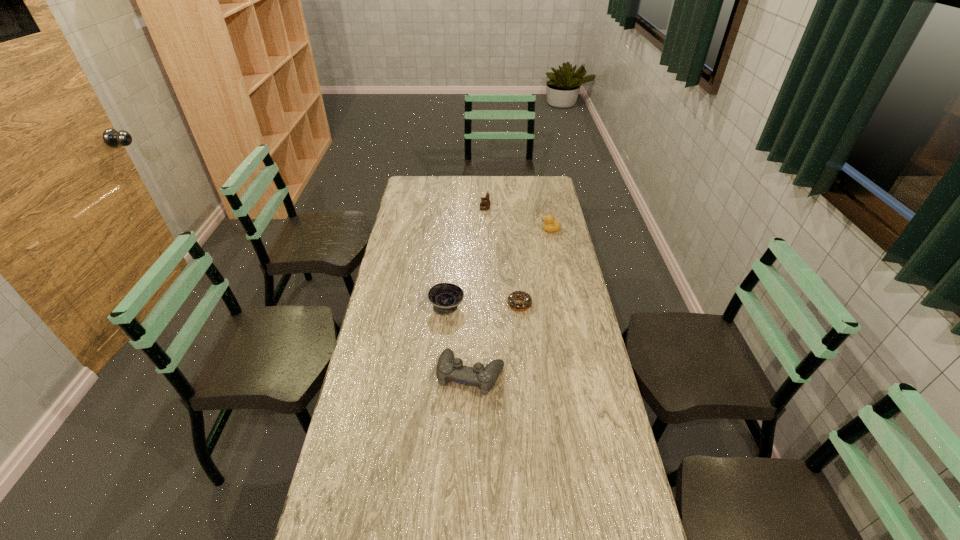
You are a GUI agent. You are given a task and a screenshot of the screen. Output one action in this format:
    pyautogui.click(x=<x>, y=<y>)
    Task: Click on the free space at the far right corner
    This screenshot has width=960, height=540.
    Given the screenshot: What is the action you would take?
    pyautogui.click(x=547, y=179)

Where is `free spot between the control and the teddy bear`? free spot between the control and the teddy bear is located at coordinates (478, 292).

Where is `free space between the rightmost object and the farthest object`? The width and height of the screenshot is (960, 540). free space between the rightmost object and the farthest object is located at coordinates (517, 219).

Where is `empty location between the control and the shortest object`? The height and width of the screenshot is (540, 960). empty location between the control and the shortest object is located at coordinates (495, 339).

At what (x,y) coordinates should I click in order to perform the action: click on vacant area that lies between the second farthest object and the farthest object. Please return your answer as a coordinate pair (x, y). Looking at the image, I should click on (517, 219).

Locate an element on the screen. The image size is (960, 540). empty location between the bowl and the duckling is located at coordinates (498, 268).

Locate an element on the screen. The height and width of the screenshot is (540, 960). unoccupied position between the nearest object and the bowl is located at coordinates (459, 341).

Select which object is the third closest to the shortest object. Please provide its 2D coordinates. Your answer should be formatted as a tuple, i.e. [(x, y)], where the tuple contains the x and y coordinates of a point satisfying the conditions above.

[(549, 225)]

The width and height of the screenshot is (960, 540). I want to click on object that is the closest to the fourth object from left to right, so click(x=445, y=297).

This screenshot has width=960, height=540. What are the coordinates of `vacant space that satisfies the following two spatial constraints: 1. on the back side of the bowl; 2. on the left side of the shortest object` in the screenshot? It's located at (446, 304).